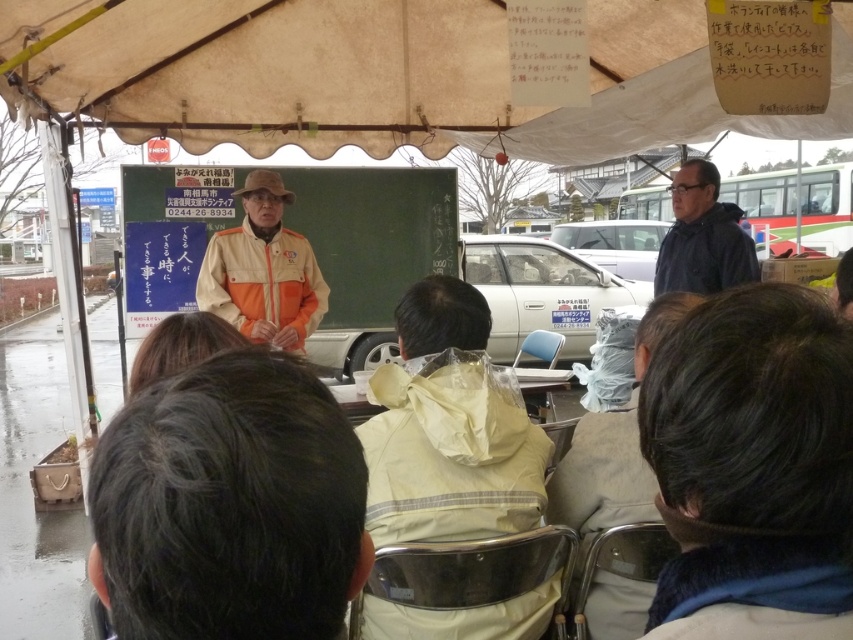
This screenshot has width=853, height=640. What do you see at coordinates (379, 76) in the screenshot?
I see `white fabric canopy at upper center` at bounding box center [379, 76].

Which of these two, white fabric canopy at upper center or beige fabric jacket at center, stands shorter?

beige fabric jacket at center is shorter.

Is point (456, 42) behind point (560, 465)?

That is True.

Where is `white fabric canopy at upper center`? The width and height of the screenshot is (853, 640). white fabric canopy at upper center is located at coordinates (379, 76).

Does green chalkboard at center appear under dark blue jacket at upper right?

Incorrect, green chalkboard at center is not positioned below dark blue jacket at upper right.

Can you confirm if green chalkboard at center is taller than dark blue jacket at upper right?

Indeed, green chalkboard at center has a greater height compared to dark blue jacket at upper right.

Is point (424, 196) farther from viewer compared to point (701, 228)?

Yes, point (424, 196) is behind point (701, 228).

Identify the location of green chalkboard at center. (373, 234).

Is point (361, 172) farther from camera compared to point (242, 333)?

Yes.

Is green chalkboard at center smaller than orange fabric jacket at center?

No, green chalkboard at center is not smaller than orange fabric jacket at center.

Between point (416, 218) and point (281, 243), which one is positioned in front?

Point (281, 243) is in front.

This screenshot has width=853, height=640. What are the coordinates of `green chalkboard at center` in the screenshot? It's located at (373, 234).